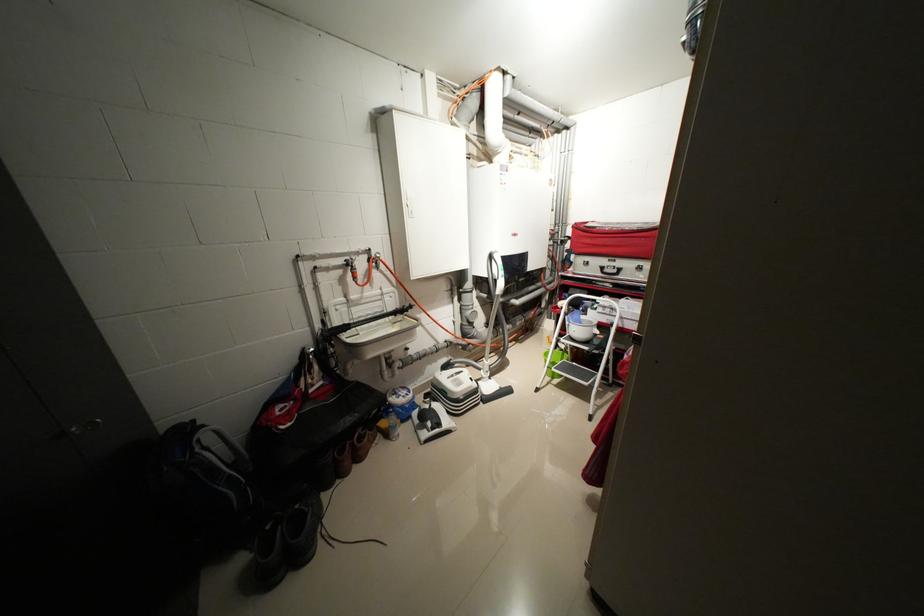
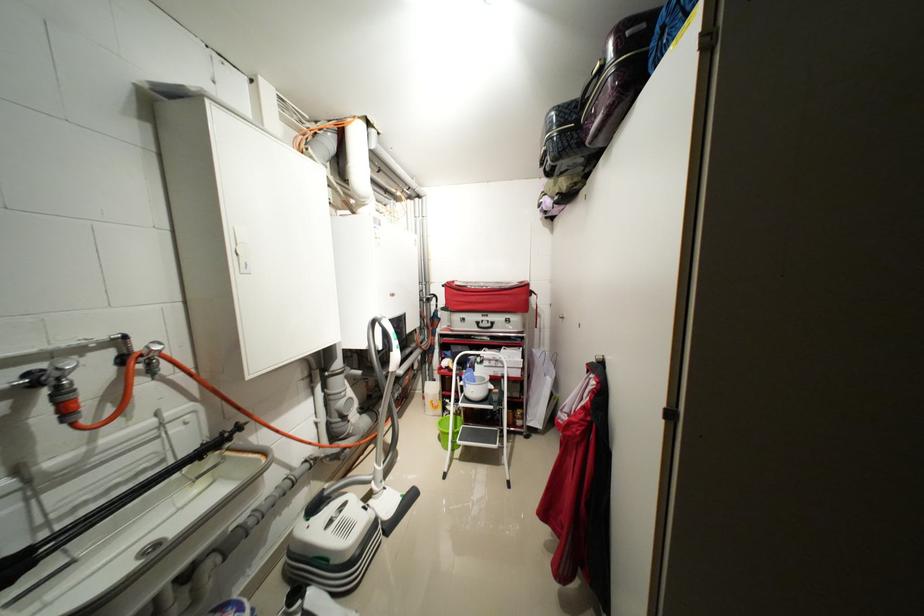
In the second image, find the point that corresponds to the point at 623,272 in the first image.

(496, 326)